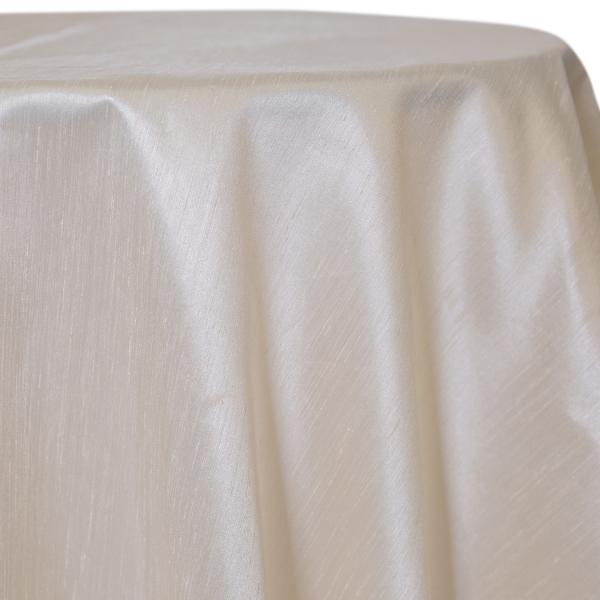
The image size is (600, 600). Find the location of `table top`. table top is located at coordinates pos(222,42).